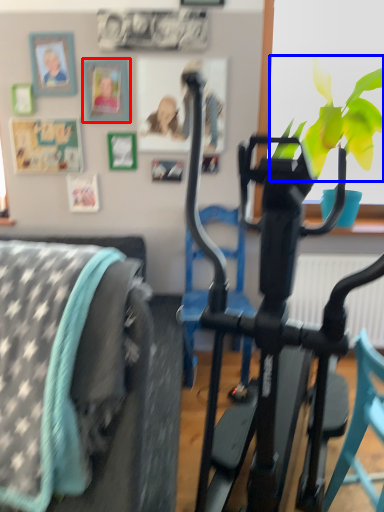
Question: Which object appears closest to the camera in this image, picture frame (highlighted by a red box) or flower (highlighted by a blue box)?

Choices:
 (A) picture frame
 (B) flower

Answer: (B)